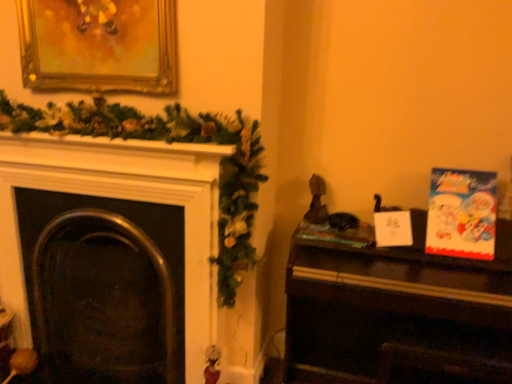
Question: From the image's perspective, is wooden piano at right located above metallic dark fireplace at left?

Choices:
 (A) no
 (B) yes

Answer: (A)

Question: Does wooden piano at right turn towards metallic dark fireplace at left?

Choices:
 (A) yes
 (B) no

Answer: (B)

Question: Is wooden piano at right shorter than metallic dark fireplace at left?

Choices:
 (A) no
 (B) yes

Answer: (B)

Question: Is wooden piano at right thinner than metallic dark fireplace at left?

Choices:
 (A) yes
 (B) no

Answer: (B)

Question: Does wooden piano at right have a smaller size compared to metallic dark fireplace at left?

Choices:
 (A) no
 (B) yes

Answer: (A)

Question: In terms of height, does wooden piano at right look taller or shorter compared to cartoon paper christmas card at right?

Choices:
 (A) short
 (B) tall

Answer: (B)

Question: From a real-world perspective, relative to cartoon paper christmas card at right, is wooden piano at right vertically above or below?

Choices:
 (A) below
 (B) above

Answer: (A)

Question: Is wooden piano at right inside or outside of cartoon paper christmas card at right?

Choices:
 (A) outside
 (B) inside

Answer: (A)

Question: Considering the relative positions of wooden piano at right and cartoon paper christmas card at right in the image provided, is wooden piano at right to the left or to the right of cartoon paper christmas card at right?

Choices:
 (A) left
 (B) right

Answer: (A)

Question: Looking at their shapes, would you say gold ornate picture frame at upper left is wider or thinner than hardcover book at center-right?

Choices:
 (A) thin
 (B) wide

Answer: (A)

Question: From their relative heights in the image, would you say gold ornate picture frame at upper left is taller or shorter than hardcover book at center-right?

Choices:
 (A) tall
 (B) short

Answer: (A)

Question: Is gold ornate picture frame at upper left in front of or behind hardcover book at center-right in the image?

Choices:
 (A) front
 (B) behind

Answer: (A)

Question: Is gold ornate picture frame at upper left inside or outside of hardcover book at center-right?

Choices:
 (A) outside
 (B) inside

Answer: (A)

Question: Considering the positions of wooden piano at right and metallic dark fireplace at left in the image, is wooden piano at right wider or thinner than metallic dark fireplace at left?

Choices:
 (A) wide
 (B) thin

Answer: (A)

Question: Based on their positions, is wooden piano at right located to the left or right of metallic dark fireplace at left?

Choices:
 (A) right
 (B) left

Answer: (A)